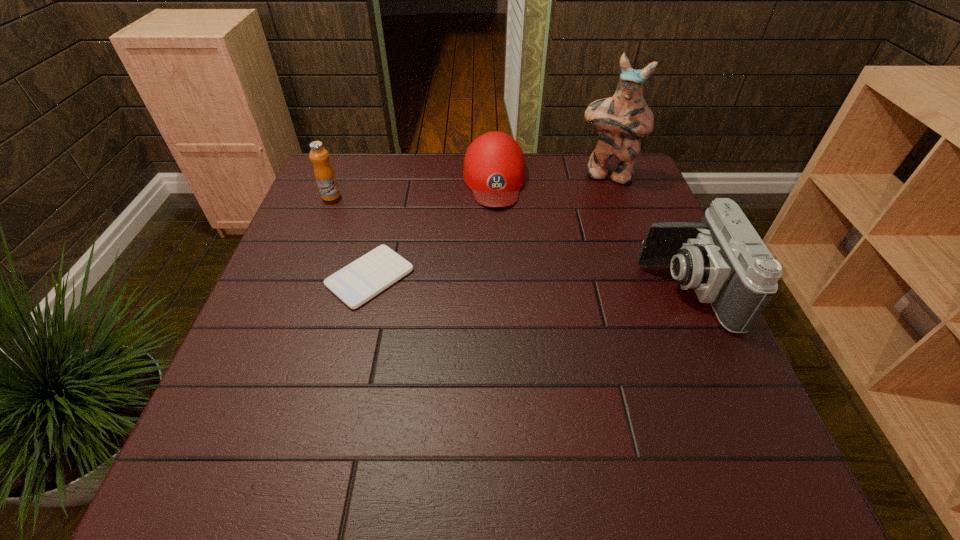
Locate an element on the screen. This screenshot has height=540, width=960. calculator is located at coordinates (355, 284).

Locate an element on the screen. The width and height of the screenshot is (960, 540). the shortest object is located at coordinates (355, 284).

Where is `camera`? camera is located at coordinates (723, 258).

The width and height of the screenshot is (960, 540). What are the coordinates of `the leftmost object` in the screenshot? It's located at (325, 177).

I want to click on the second shortest object, so click(494, 169).

Locate an element on the screen. This screenshot has width=960, height=540. baseball cap is located at coordinates (494, 169).

You are a GUI agent. You are given a task and a screenshot of the screen. Output one action in this format:
    pyautogui.click(x=<x>, y=<y>)
    Task: Click on the tallest object
    
    Given the screenshot: What is the action you would take?
    pyautogui.click(x=622, y=120)

At what (x,y) coordinates should I click in order to perform the action: click on vacant region located 0.120m on the left of the fourth object from right to left. Please return your answer as a coordinate pair (x, y). This screenshot has height=540, width=960. Looking at the image, I should click on (276, 277).

You are a GUI agent. You are given a task and a screenshot of the screen. Output one action in this format:
    pyautogui.click(x=<x>, y=<y>)
    Task: Click on the vacant space situated at the front of the camera with an open lens cover
    This screenshot has height=540, width=960.
    Given the screenshot: What is the action you would take?
    pyautogui.click(x=491, y=289)

You are a GUI agent. You are given a task and a screenshot of the screen. Output one action in this format:
    pyautogui.click(x=<x>, y=<y>)
    Task: Click on the vacant area situated 0.130m at the front of the camera with an open lens cover
    The width and height of the screenshot is (960, 540).
    Given the screenshot: What is the action you would take?
    pyautogui.click(x=587, y=289)